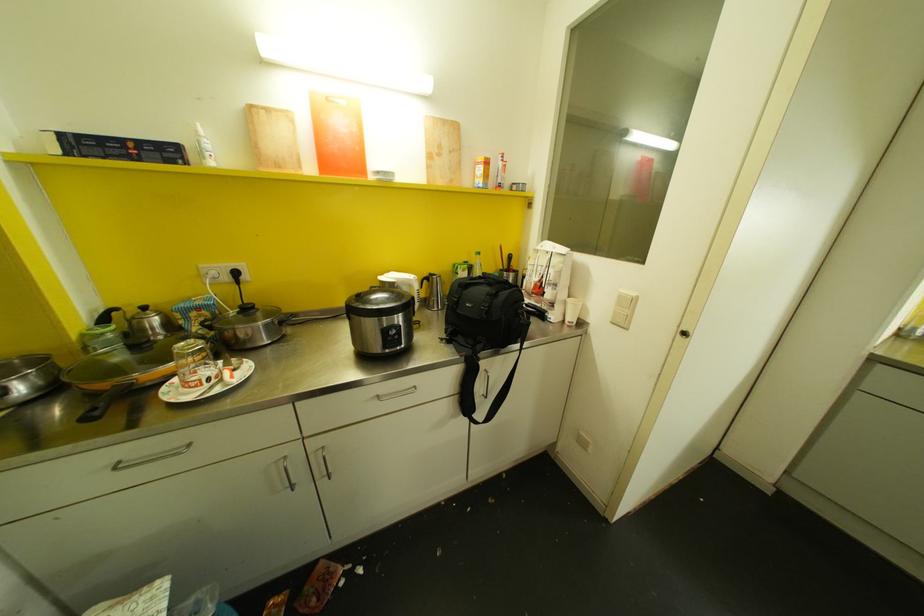
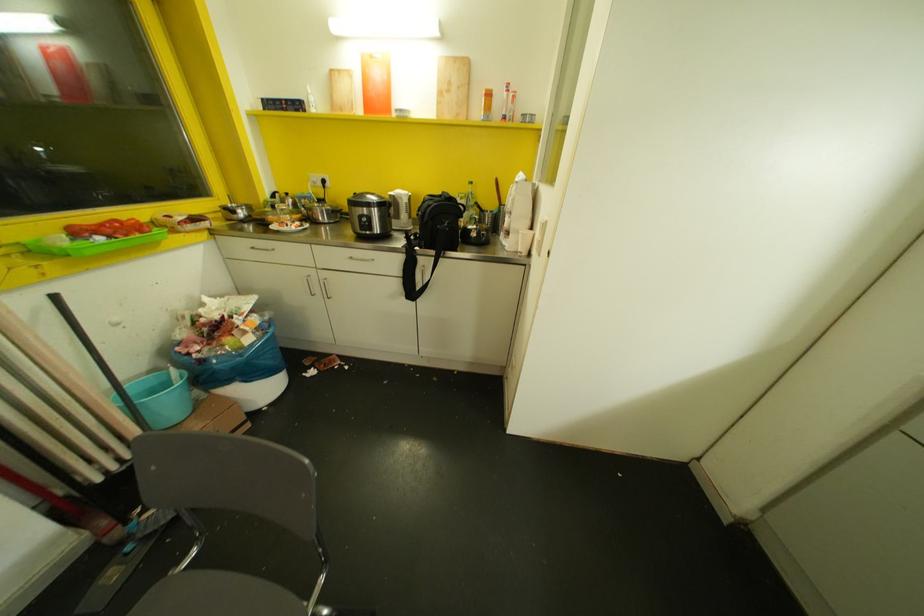
Question: The images are taken continuously from a first-person perspective. In which direction is your viewpoint rotating?

Choices:
 (A) Left
 (B) Right
 (C) Up
 (D) Down

Answer: (A)